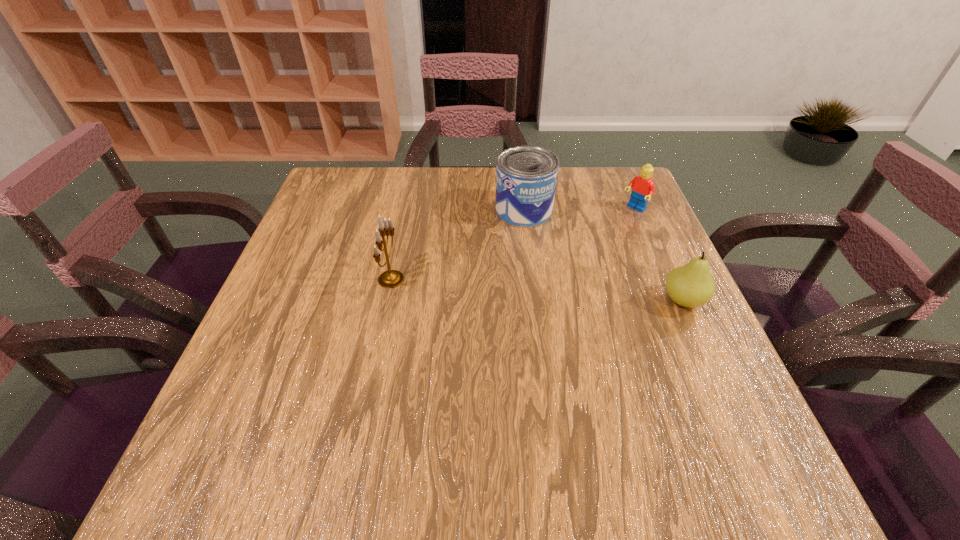
Identify the location of free space between the Lego and the leftmost object. The height and width of the screenshot is (540, 960). (513, 244).

Find the location of a particular element. The image size is (960, 540). free space between the leftmost object and the Lego is located at coordinates (513, 244).

Where is `free space that is in between the Lego and the tallest object`? This screenshot has width=960, height=540. free space that is in between the Lego and the tallest object is located at coordinates (513, 244).

Where is `vacant space in between the Lego and the second object from left to right`? The image size is (960, 540). vacant space in between the Lego and the second object from left to right is located at coordinates (579, 210).

Select which object is the second closest to the pear. Please provide its 2D coordinates. Your answer should be formatted as a tuple, i.e. [(x, y)], where the tuple contains the x and y coordinates of a point satisfying the conditions above.

[(526, 176)]

Identify the location of object that is the closest to the can. (643, 187).

The image size is (960, 540). In order to click on free space that satisfies the following two spatial constraints: 1. on the front side of the pear; 2. on the left side of the candelabrum in this screenshot , I will do `click(387, 301)`.

This screenshot has width=960, height=540. What are the coordinates of `vacant point that satisfies the following two spatial constraints: 1. on the front side of the can; 2. on the left side of the pear` in the screenshot? It's located at (535, 301).